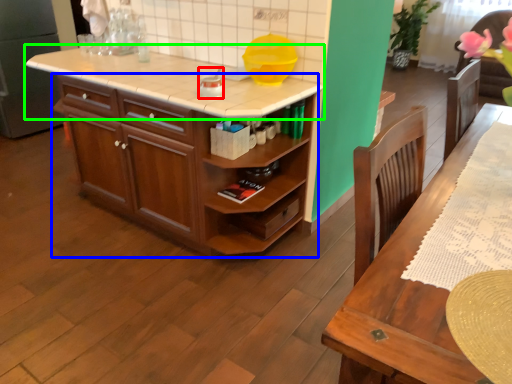
Question: Estimate the real-world distances between objects in this image. Which object is closer to appliance (highlighted by a red box), cabinetry (highlighted by a blue box) or countertop (highlighted by a green box)?

Choices:
 (A) cabinetry
 (B) countertop

Answer: (B)